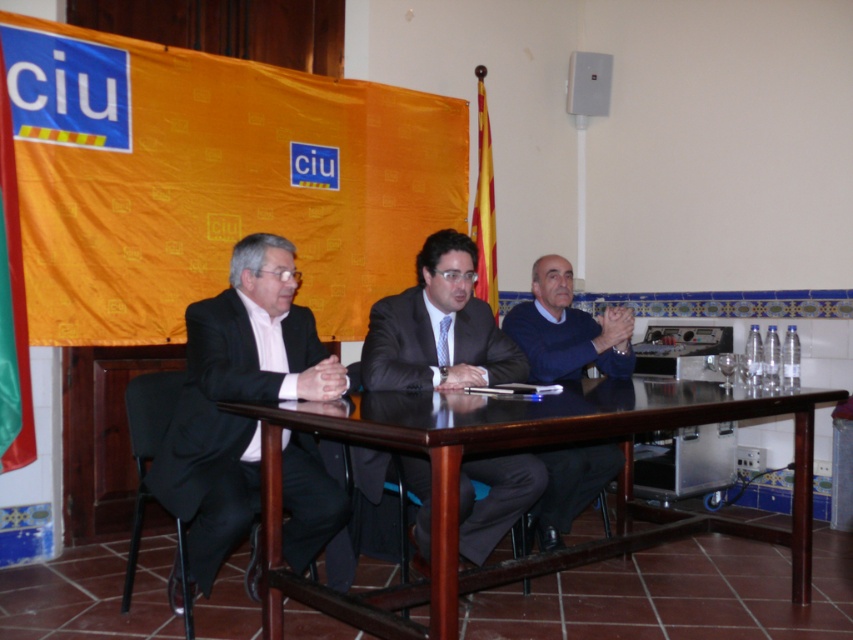
Question: Can you confirm if matte black suit at left is positioned to the right of matte black suit at center?

Choices:
 (A) no
 (B) yes

Answer: (A)

Question: Which object is positioned closest to the dark blue sweater at center?

Choices:
 (A) mahogany wood table at center
 (B) matte black suit at left

Answer: (A)

Question: Is mahogany wood table at center above matte black suit at left?

Choices:
 (A) yes
 (B) no

Answer: (B)

Question: Estimate the real-world distances between objects in this image. Which object is farther from the mahogany wood table at center?

Choices:
 (A) matte black suit at center
 (B) matte black suit at left
 (C) dark blue sweater at center

Answer: (C)

Question: Is mahogany wood table at center closer to camera compared to dark blue sweater at center?

Choices:
 (A) no
 (B) yes

Answer: (B)

Question: Which of the following is the closest to the observer?

Choices:
 (A) (196, 337)
 (B) (428, 476)
 (C) (567, 282)
 (D) (410, 600)

Answer: (A)